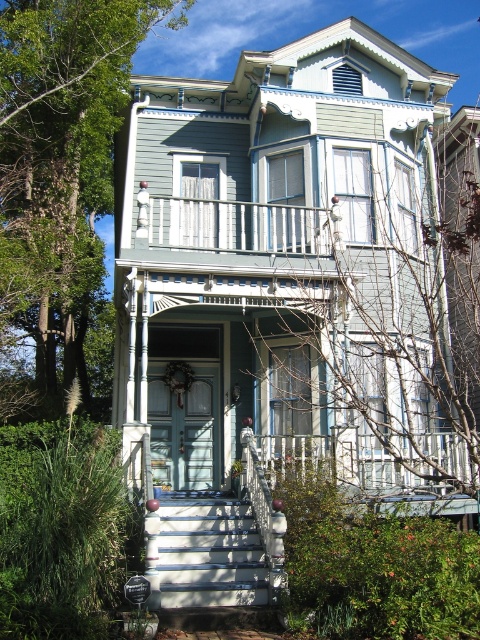
You are standing in front of the Victorian house and notice two points marked on the image. Which point, point [146,524] or point [170,209], is closer to you?

Point [146,524] is closer to the camera than point [170,209], so it is closer to you.